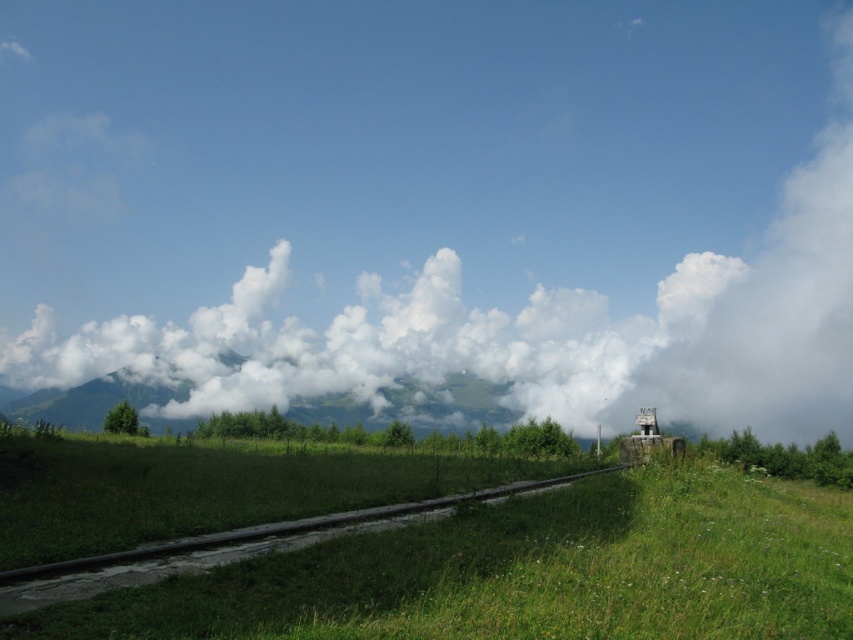
Looking at this image, you are an airplane pilot flying over the landscape described in the scene. You notice the white fluffy cloud at upper center and the green grassy at center. Which object is closer to your current position?

The white fluffy cloud at upper center is closer to your current position because it is further to the viewer than the green grassy at center.

You are standing in the grassy field with wildflowers and looking towards the railway tracks. There is a white fluffy cloud at upper center located at point (436, 202). Can you see the white fluffy cloud at upper center from your current position?

Yes, the white fluffy cloud at upper center is located at point (436, 202), which is in the upper center of the scene, so it should be visible from your position in the grassy field.